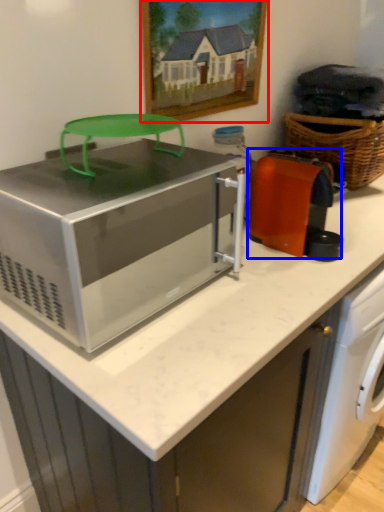
Question: Which point is further to the camera, picture frame (highlighted by a red box) or appliance (highlighted by a blue box)?

Choices:
 (A) picture frame
 (B) appliance

Answer: (A)